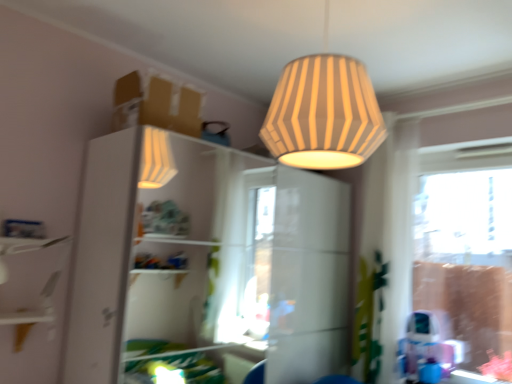
Question: Looking at their shapes, would you say white glossy dresser at upper center is wider or thinner than clear glass window at right?

Choices:
 (A) wide
 (B) thin

Answer: (A)

Question: Is white glossy dresser at upper center taller or shorter than clear glass window at right?

Choices:
 (A) tall
 (B) short

Answer: (A)

Question: Which is nearer to the white glossy dresser at upper center?

Choices:
 (A) striped paper lampshade at upper center
 (B) clear glass window at right
 (C) white glossy shelf at left

Answer: (C)

Question: Estimate the real-world distances between objects in this image. Which object is closer to the clear glass window at right?

Choices:
 (A) white glossy shelf at left
 (B) striped paper lampshade at upper center
 (C) white glossy dresser at upper center

Answer: (B)